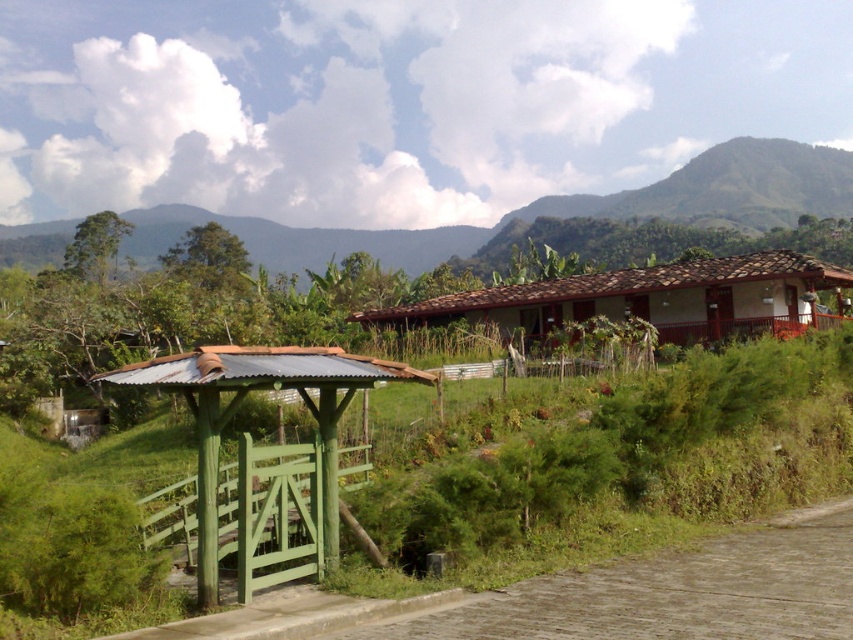
Question: Considering the relative positions of brown cobblestone path at lower right and green wood/glass hut at lower left in the image provided, where is brown cobblestone path at lower right located with respect to green wood/glass hut at lower left?

Choices:
 (A) below
 (B) above

Answer: (A)

Question: Which point is farther to the camera?

Choices:
 (A) green wood/glass hut at lower left
 (B) brown clay roof hut at center
 (C) brown cobblestone path at lower right

Answer: (B)

Question: Which object is farther from the camera taking this photo?

Choices:
 (A) brown clay roof hut at center
 (B) brown cobblestone path at lower right

Answer: (A)

Question: Is brown cobblestone path at lower right thinner than brown clay roof hut at center?

Choices:
 (A) yes
 (B) no

Answer: (A)

Question: Does brown cobblestone path at lower right have a larger size compared to brown clay roof hut at center?

Choices:
 (A) no
 (B) yes

Answer: (A)

Question: Which object is positioned closest to the brown clay roof hut at center?

Choices:
 (A) green wood/glass hut at lower left
 (B) brown cobblestone path at lower right

Answer: (A)